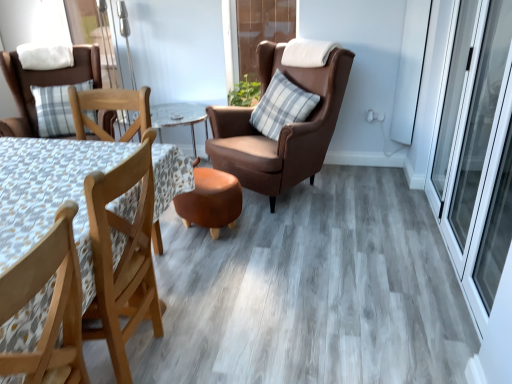
Question: Could you tell me if matte brown chair at left, the first chair in the back-to-front sequence, is turned towards wooden chair at lower left, marked as the 1th chair in a front-to-back arrangement?

Choices:
 (A) no
 (B) yes

Answer: (B)

Question: Considering the relative positions of matte brown chair at left, the third chair when ordered from front to back, and wooden chair at lower left, placed as the 2th chair when sorted from left to right, in the image provided, is matte brown chair at left, the third chair when ordered from front to back, to the left of wooden chair at lower left, placed as the 2th chair when sorted from left to right, from the viewer's perspective?

Choices:
 (A) yes
 (B) no

Answer: (A)

Question: Does matte brown chair at left, the first chair from the left, come behind wooden chair at lower left, the third chair viewed from the back?

Choices:
 (A) no
 (B) yes

Answer: (B)

Question: Considering the relative sizes of matte brown chair at left, the third chair when ordered from front to back, and wooden chair at lower left, the second chair from the right, in the image provided, is matte brown chair at left, the third chair when ordered from front to back, shorter than wooden chair at lower left, the second chair from the right,?

Choices:
 (A) no
 (B) yes

Answer: (B)

Question: Is matte brown chair at left, the first chair in the back-to-front sequence, turned away from wooden chair at lower left, placed as the 2th chair when sorted from left to right?

Choices:
 (A) yes
 (B) no

Answer: (B)

Question: Considering their positions, is blue plaid pillow at center, positioned as the first pillow in right-to-left order, located in front of or behind wooden chair at lower left, marked as the 1th chair in a front-to-back arrangement?

Choices:
 (A) behind
 (B) front

Answer: (A)

Question: Is point (263, 114) closer or farther from the camera than point (56, 240)?

Choices:
 (A) closer
 (B) farther

Answer: (B)

Question: From their relative heights in the image, would you say blue plaid pillow at center, which is the second pillow from left to right, is taller or shorter than wooden chair at lower left, the third chair viewed from the back?

Choices:
 (A) tall
 (B) short

Answer: (B)

Question: From the image's perspective, is blue plaid pillow at center, arranged as the 2th pillow when viewed from the top, above or below wooden chair at lower left, marked as the 1th chair in a front-to-back arrangement?

Choices:
 (A) below
 (B) above

Answer: (B)

Question: From a real-world perspective, is wooden table at left above or below white soft pillow at upper left, which is the 1th pillow in top-to-bottom order?

Choices:
 (A) above
 (B) below

Answer: (B)

Question: In terms of width, does wooden table at left look wider or thinner when compared to white soft pillow at upper left, marked as the 1th pillow in a left-to-right arrangement?

Choices:
 (A) wide
 (B) thin

Answer: (A)

Question: Looking at the image, does wooden table at left seem bigger or smaller compared to white soft pillow at upper left, arranged as the 2th pillow when viewed from the right?

Choices:
 (A) big
 (B) small

Answer: (A)

Question: In the image, is wooden table at left on the left side or the right side of white soft pillow at upper left, marked as the 1th pillow in a left-to-right arrangement?

Choices:
 (A) left
 (B) right

Answer: (B)

Question: Is point (29, 110) positioned closer to the camera than point (82, 243)?

Choices:
 (A) farther
 (B) closer

Answer: (A)

Question: From a real-world perspective, relative to wooden table at left, is matte brown chair at left, the third chair when ordered from front to back, vertically above or below?

Choices:
 (A) above
 (B) below

Answer: (A)